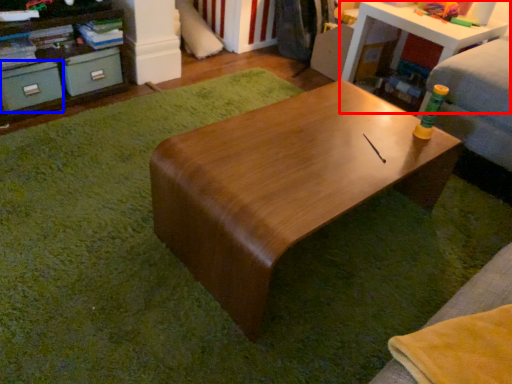
Question: Which point is further to the camera, table (highlighted by a red box) or drawer (highlighted by a blue box)?

Choices:
 (A) table
 (B) drawer

Answer: (A)